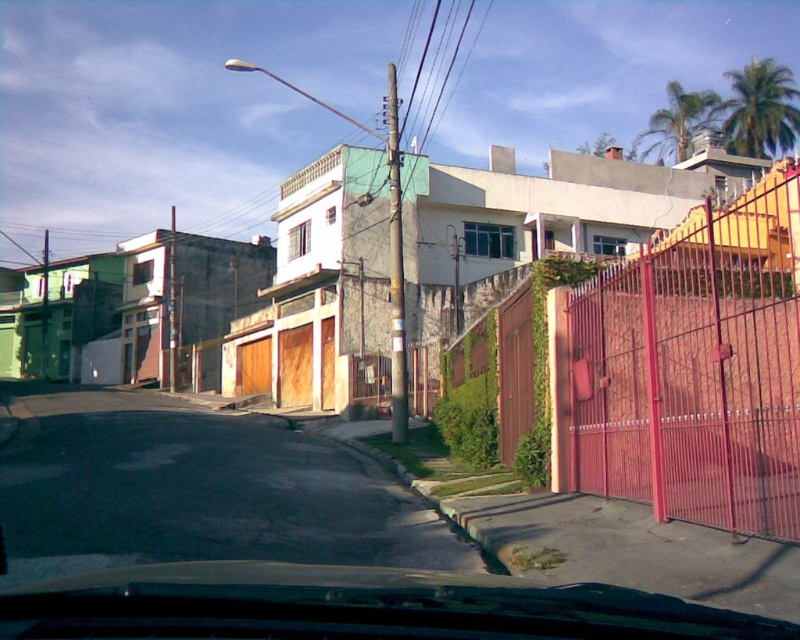
You are driving a car with a 5.5 meter turning radius and need to make a sharp turn onto the road from the asphalt at lower left. Can you safely navigate the turn without hitting the metallic red gate at right?

The metallic red gate at right is 7.09 meters from asphalt at lower left. Since the distance between them is greater than your car turning radius of 5.5 meters, you can safely navigate the turn without hitting the metallic red gate at right.

You are driving a car and looking at the road ahead. There is a point marked at coordinates (x=690, y=369) on your dashboard screen. What does this point correspond to?

The point at (x=690, y=369) corresponds to the metallic red gate at right.

Looking at this image, you are driving a car and want to park near the metallic red gate at right. The parking spot is marked by the asphalt at lower left. Can you fit your car into the parking spot based on their sizes?

The metallic red gate at right is larger in size than asphalt at lower left, so the parking spot at asphalt at lower left might be too small for your car to fit comfortably.